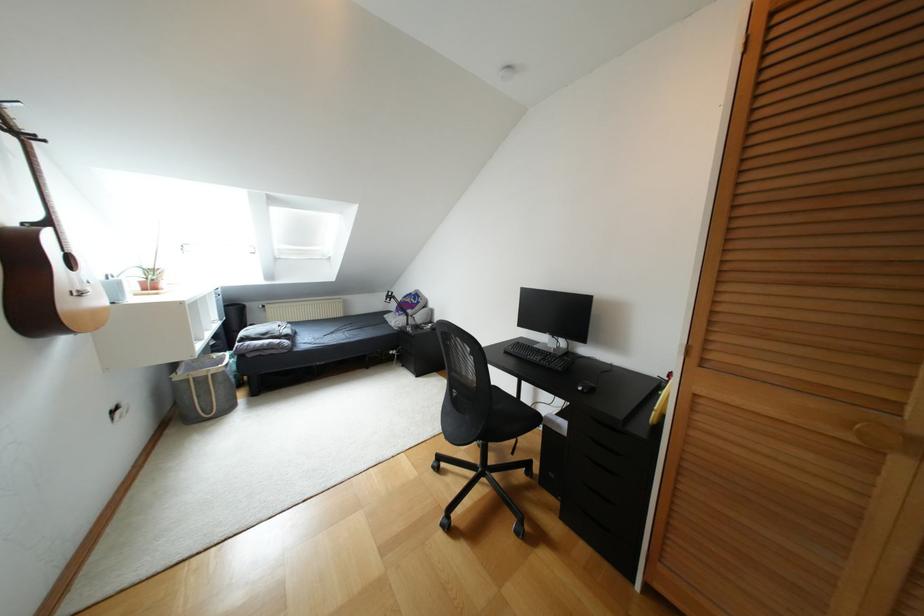
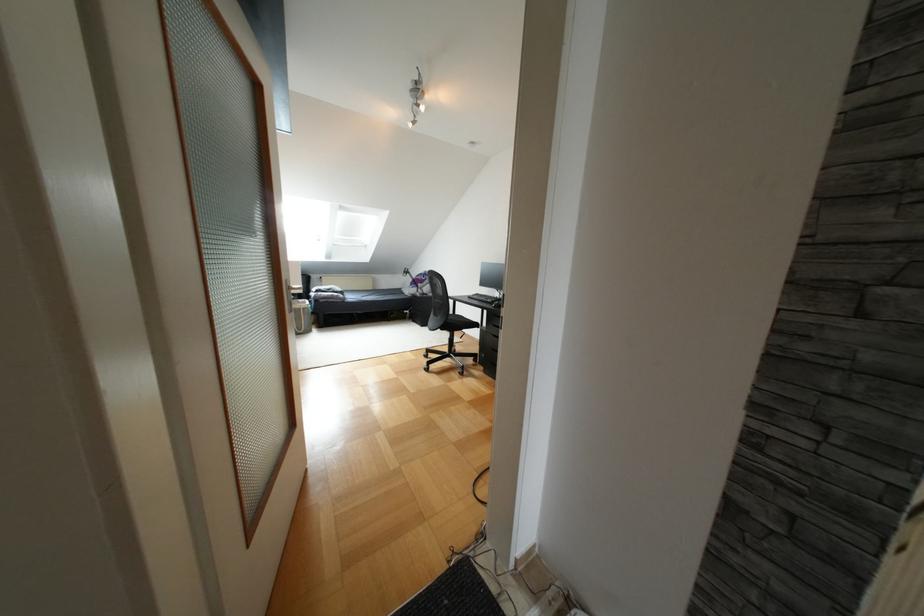
Question: In a continuous first-person perspective shot, in which direction is the camera moving?

Choices:
 (A) Left
 (B) Right
 (C) Forward
 (D) Backward

Answer: (D)